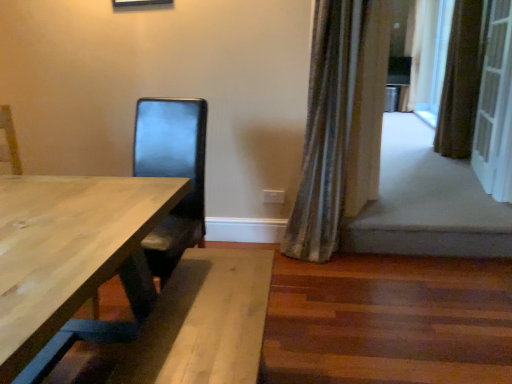
Question: Considering the relative sizes of silky beige curtain at upper right, marked as the 3th curtain in a front-to-back arrangement, and silky green curtain at right, the third curtain viewed from the right, in the image provided, is silky beige curtain at upper right, marked as the 3th curtain in a front-to-back arrangement, smaller than silky green curtain at right, the third curtain viewed from the right,?

Choices:
 (A) no
 (B) yes

Answer: (B)

Question: Is silky beige curtain at upper right, the first curtain positioned from the back, to the right of silky green curtain at right, the 1th curtain positioned from the front, from the viewer's perspective?

Choices:
 (A) yes
 (B) no

Answer: (A)

Question: Is silky beige curtain at upper right, marked as the 3th curtain in a front-to-back arrangement, not inside silky green curtain at right, which is counted as the first curtain, starting from the left?

Choices:
 (A) yes
 (B) no

Answer: (A)

Question: From a real-world perspective, is silky beige curtain at upper right, marked as the 3th curtain in a left-to-right arrangement, beneath silky green curtain at right, the 1th curtain positioned from the front?

Choices:
 (A) no
 (B) yes

Answer: (A)

Question: Can you confirm if silky beige curtain at upper right, the first curtain positioned from the back, is taller than silky green curtain at right, the 1th curtain positioned from the front?

Choices:
 (A) no
 (B) yes

Answer: (B)

Question: From a real-world perspective, is silky beige curtain at upper right, marked as the 3th curtain in a left-to-right arrangement, physically above silky green curtain at right, the 1th curtain positioned from the front?

Choices:
 (A) yes
 (B) no

Answer: (A)

Question: From a real-world perspective, is white textured screen door at right located beneath silky beige curtain at upper right, marked as the 3th curtain in a left-to-right arrangement?

Choices:
 (A) yes
 (B) no

Answer: (A)

Question: Does white textured screen door at right have a smaller size compared to silky beige curtain at upper right, which appears as the 1th curtain when viewed from the right?

Choices:
 (A) yes
 (B) no

Answer: (A)

Question: Is white textured screen door at right aimed at silky beige curtain at upper right, which appears as the 1th curtain when viewed from the right?

Choices:
 (A) no
 (B) yes

Answer: (A)

Question: Does white textured screen door at right have a lesser width compared to silky beige curtain at upper right, marked as the 3th curtain in a front-to-back arrangement?

Choices:
 (A) no
 (B) yes

Answer: (B)

Question: Would you say white textured screen door at right is outside silky beige curtain at upper right, the first curtain positioned from the back?

Choices:
 (A) no
 (B) yes

Answer: (B)

Question: Considering the relative positions of white textured screen door at right and silky beige curtain at upper right, the first curtain positioned from the back, in the image provided, is white textured screen door at right in front of silky beige curtain at upper right, the first curtain positioned from the back,?

Choices:
 (A) no
 (B) yes

Answer: (B)

Question: Are white textured screen door at right and brown textured curtain at right, placed as the 2th curtain when sorted from right to left, far apart?

Choices:
 (A) no
 (B) yes

Answer: (A)